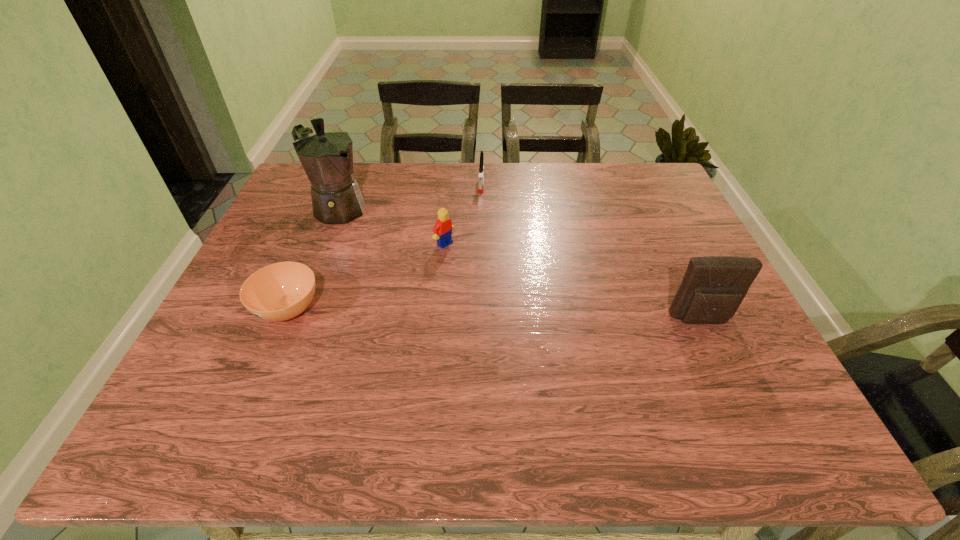
Find the location of a particular element. vacant space positioned 0.370m on the pouring side of the tallest object is located at coordinates (448, 279).

Identify the location of free space located 0.220m on the pouring side of the tallest object. (407, 252).

Find the location of a particular element. vacant area situated on the pouring side of the tallest object is located at coordinates (426, 264).

Identify the location of free space located 0.330m on the face of the third object from right to left. The image size is (960, 540). [549, 314].

Where is `free space located on the face of the third object from right to left`? free space located on the face of the third object from right to left is located at coordinates (564, 324).

Identify the location of vacant space situated on the face of the third object from right to left. 549,314.

You are a GUI agent. You are given a task and a screenshot of the screen. Output one action in this format:
    pyautogui.click(x=<x>, y=<y>)
    Task: Click on the vacant region located 0.190m on the handle side of the fourth tallest object
    
    Given the screenshot: What is the action you would take?
    pyautogui.click(x=477, y=231)

This screenshot has width=960, height=540. Find the location of `vacant position located on the handle side of the fourth tallest object`. vacant position located on the handle side of the fourth tallest object is located at coordinates (471, 284).

Where is `vacant position located 0.150m on the handle side of the fourth tallest object`? This screenshot has width=960, height=540. vacant position located 0.150m on the handle side of the fourth tallest object is located at coordinates (478, 222).

Identify the location of coffeepot that is at the far edge. (326, 155).